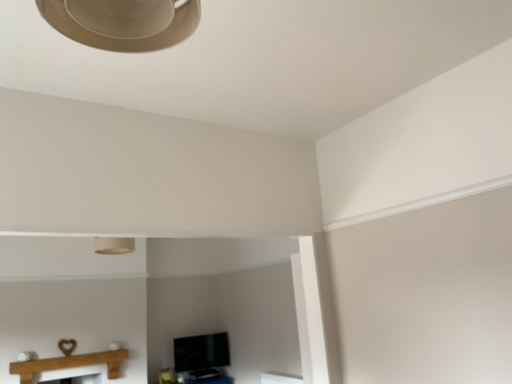
Question: Does wooden mantle at lower left have a greater height compared to matte beige lampshade at upper center?

Choices:
 (A) yes
 (B) no

Answer: (A)

Question: From a real-world perspective, is wooden mantle at lower left on top of matte beige lampshade at upper center?

Choices:
 (A) yes
 (B) no

Answer: (B)

Question: Is wooden mantle at lower left positioned with its back to matte beige lampshade at upper center?

Choices:
 (A) no
 (B) yes

Answer: (A)

Question: Considering the relative positions of wooden mantle at lower left and matte beige lampshade at upper center in the image provided, is wooden mantle at lower left to the left of matte beige lampshade at upper center from the viewer's perspective?

Choices:
 (A) yes
 (B) no

Answer: (A)

Question: Does wooden mantle at lower left come in front of matte beige lampshade at upper center?

Choices:
 (A) yes
 (B) no

Answer: (B)

Question: Does wooden mantle at lower left come behind matte beige lampshade at upper center?

Choices:
 (A) yes
 (B) no

Answer: (A)

Question: From the image's perspective, is matte beige lampshade at upper center on wooden mantle at lower left?

Choices:
 (A) yes
 (B) no

Answer: (A)

Question: Is matte beige lampshade at upper center outside wooden mantle at lower left?

Choices:
 (A) no
 (B) yes

Answer: (B)

Question: From a real-world perspective, is matte beige lampshade at upper center located higher than wooden mantle at lower left?

Choices:
 (A) yes
 (B) no

Answer: (A)

Question: Can you confirm if matte beige lampshade at upper center is positioned to the left of wooden mantle at lower left?

Choices:
 (A) yes
 (B) no

Answer: (B)

Question: Does matte beige lampshade at upper center have a greater height compared to wooden mantle at lower left?

Choices:
 (A) yes
 (B) no

Answer: (B)

Question: From the image's perspective, is matte beige lampshade at upper center located beneath wooden mantle at lower left?

Choices:
 (A) no
 (B) yes

Answer: (A)

Question: Is matte beige lampshade at upper center spatially inside wooden mantle at lower left, or outside of it?

Choices:
 (A) inside
 (B) outside

Answer: (B)